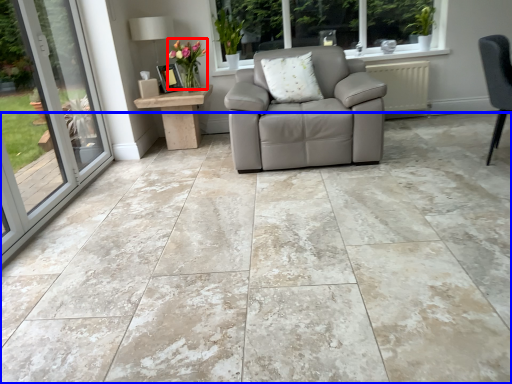
Question: Which of the following is the farthest to the observer, flower (highlighted by a red box) or concrete (highlighted by a blue box)?

Choices:
 (A) flower
 (B) concrete

Answer: (A)